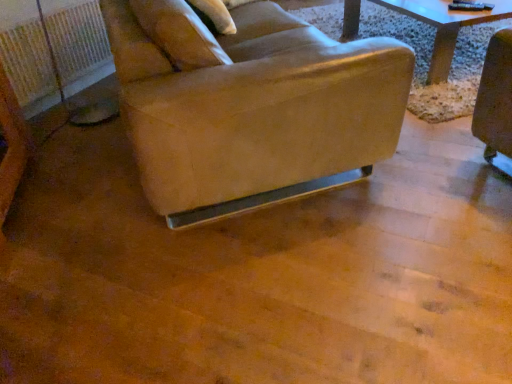
Question: Can you confirm if beige fabric pillow at upper center is shorter than leather-like beige chair at center?

Choices:
 (A) no
 (B) yes

Answer: (B)

Question: Is beige fabric pillow at upper center to the right of leather-like beige chair at center from the viewer's perspective?

Choices:
 (A) no
 (B) yes

Answer: (A)

Question: From the image's perspective, is beige fabric pillow at upper center over leather-like beige chair at center?

Choices:
 (A) no
 (B) yes

Answer: (B)

Question: Is leather-like beige chair at center a part of beige fabric pillow at upper center?

Choices:
 (A) yes
 (B) no

Answer: (B)

Question: Does beige fabric pillow at upper center have a smaller size compared to leather-like beige chair at center?

Choices:
 (A) yes
 (B) no

Answer: (A)

Question: Choose the correct answer: Is white plastic radiator at left inside beige fabric pillow at upper center or outside it?

Choices:
 (A) outside
 (B) inside

Answer: (A)

Question: From the image's perspective, is white plastic radiator at left above or below beige fabric pillow at upper center?

Choices:
 (A) above
 (B) below

Answer: (B)

Question: Considering the positions of white plastic radiator at left and beige fabric pillow at upper center in the image, is white plastic radiator at left taller or shorter than beige fabric pillow at upper center?

Choices:
 (A) short
 (B) tall

Answer: (B)

Question: In terms of size, does white plastic radiator at left appear bigger or smaller than beige fabric pillow at upper center?

Choices:
 (A) small
 (B) big

Answer: (A)

Question: Is leather-like beige chair at center taller or shorter than beige fabric pillow at upper center?

Choices:
 (A) tall
 (B) short

Answer: (A)

Question: Is leather-like beige chair at center situated inside beige fabric pillow at upper center or outside?

Choices:
 (A) outside
 (B) inside

Answer: (A)

Question: From the image's perspective, is leather-like beige chair at center located above or below beige fabric pillow at upper center?

Choices:
 (A) above
 (B) below

Answer: (B)

Question: In terms of size, does leather-like beige chair at center appear bigger or smaller than beige fabric pillow at upper center?

Choices:
 (A) small
 (B) big

Answer: (B)

Question: From the image's perspective, relative to leather-like beige chair at center, is white plastic radiator at left above or below?

Choices:
 (A) below
 (B) above

Answer: (A)

Question: In the image, is white plastic radiator at left on the left side or the right side of leather-like beige chair at center?

Choices:
 (A) left
 (B) right

Answer: (A)